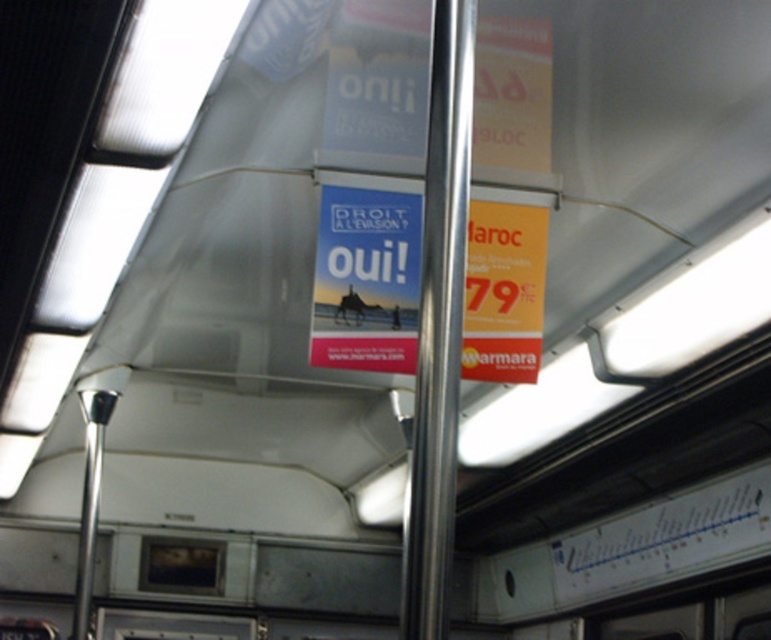
Consider the image. You are a passenger on a train and notice two points marked on the ceiling. The first point is at coordinates point (354, 356) and the second is at point (436, 376). If you want to touch the point that is closer to you, which coordinate should you reach for?

Point (436, 376) is closer to you because it is less further to the camera than point (354, 356).